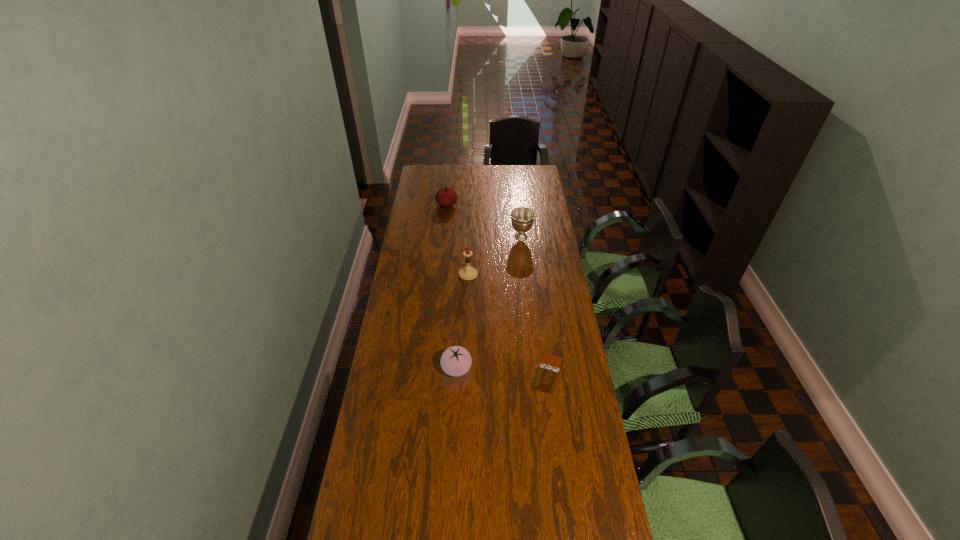
Image resolution: width=960 pixels, height=540 pixels. I want to click on vacant point that satisfies the following two spatial constraints: 1. on the front side of the chalice; 2. on the right side of the shortest object, so click(536, 373).

Image resolution: width=960 pixels, height=540 pixels. What are the coordinates of `vacant position in the image that satisfies the following two spatial constraints: 1. on the front side of the farther tomato; 2. on the right side of the candle` in the screenshot? It's located at (441, 274).

Locate an element on the screen. The image size is (960, 540). vacant space that satisfies the following two spatial constraints: 1. on the back side of the nearer tomato; 2. on the right side of the candle is located at coordinates (461, 274).